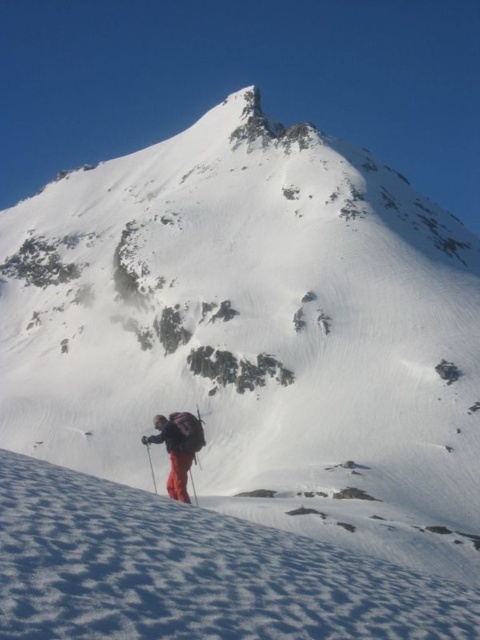
You are a drone operator trying to capture a photo of the mountain climber. You notice two points marked on your screen at coordinates point (264, 534) and point (156, 492). Which point should you focus on to ensure it appears larger in the photo?

Point (264, 534) should be focused on because it is closer to the camera and will appear larger in the photo compared to point (156, 492).